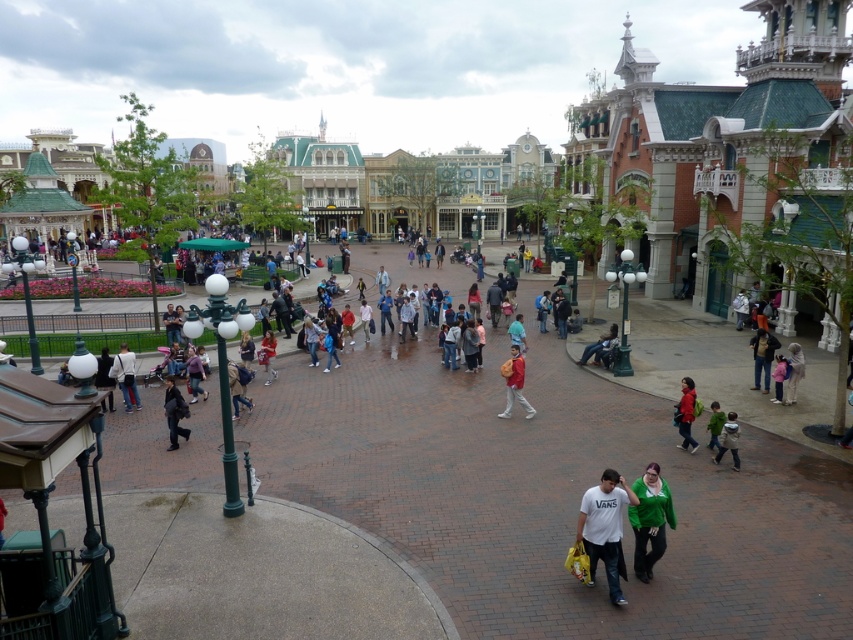
Question: Considering the real-world distances, which object is closest to the matte black jacket at lower left?

Choices:
 (A) blue fabric shirt at center
 (B) green fabric jacket at lower right
 (C) dark blue jeans at lower right
 (D) white cotton t-shirt at center

Answer: (A)

Question: Is matte red backpack at center below light brown leather backpack at lower left?

Choices:
 (A) yes
 (B) no

Answer: (B)

Question: Which object appears farthest from the camera in this image?

Choices:
 (A) red matte jacket at lower right
 (B) matte black jacket at lower left

Answer: (B)

Question: Which point appears farthest from the camera in this image?

Choices:
 (A) pos(654,529)
 (B) pos(761,364)

Answer: (B)

Question: Does matte black jacket at lower left have a lesser width compared to light pink fabric at lower right?

Choices:
 (A) no
 (B) yes

Answer: (B)

Question: Can you confirm if dark blue jeans at lower right is wider than khaki cotton pants at lower right?

Choices:
 (A) yes
 (B) no

Answer: (B)